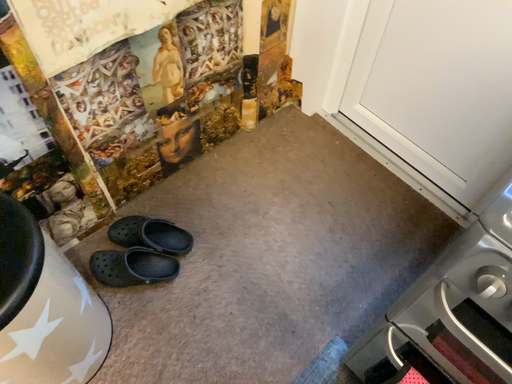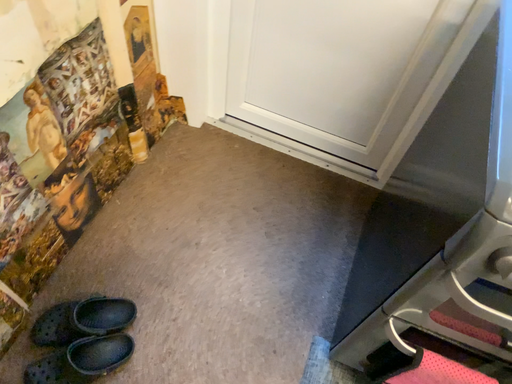
Question: How did the camera likely rotate when shooting the video?

Choices:
 (A) rotated left
 (B) rotated right

Answer: (B)